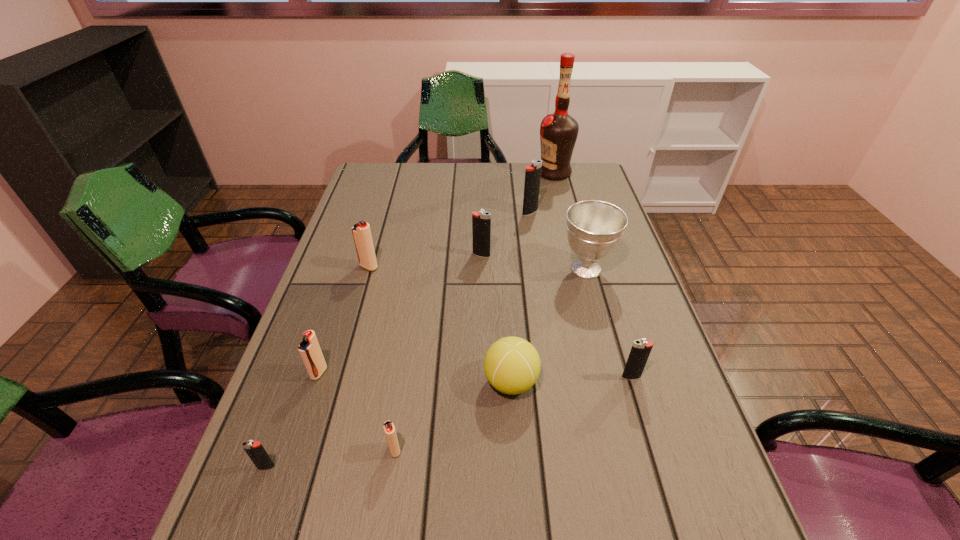
Locate an element on the screen. the rightmost black igniter is located at coordinates (640, 351).

Identify the location of the second farthest red igniter. (309, 349).

At what (x,y) coordinates should I click in order to perform the action: click on the leftmost red igniter. Please return your answer as a coordinate pair (x, y). The height and width of the screenshot is (540, 960). Looking at the image, I should click on (309, 349).

At what (x,y) coordinates should I click in order to perform the action: click on tennis ball. Please return your answer as a coordinate pair (x, y). Looking at the image, I should click on (512, 365).

Identify the location of the smallest red igniter. This screenshot has height=540, width=960. (389, 429).

This screenshot has height=540, width=960. I want to click on the nearest red igniter, so click(389, 429).

What are the coordinates of `the nearest black igniter` in the screenshot? It's located at (256, 452).

Identify the location of the leftmost object. (256, 452).

Where is `free region located on the front and back of the liquor`? Image resolution: width=960 pixels, height=540 pixels. free region located on the front and back of the liquor is located at coordinates (487, 173).

The height and width of the screenshot is (540, 960). Find the location of `vacant space located on the front and back of the liquor`. vacant space located on the front and back of the liquor is located at coordinates (459, 173).